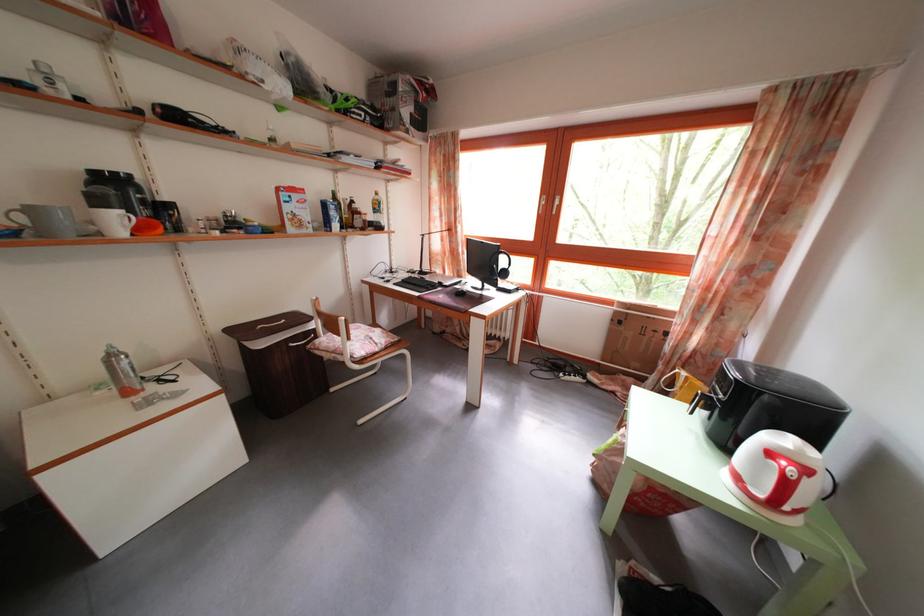
Where would you lift the brown glass bottle? Please return your answer as a coordinate pair (x, y).

(338, 208)